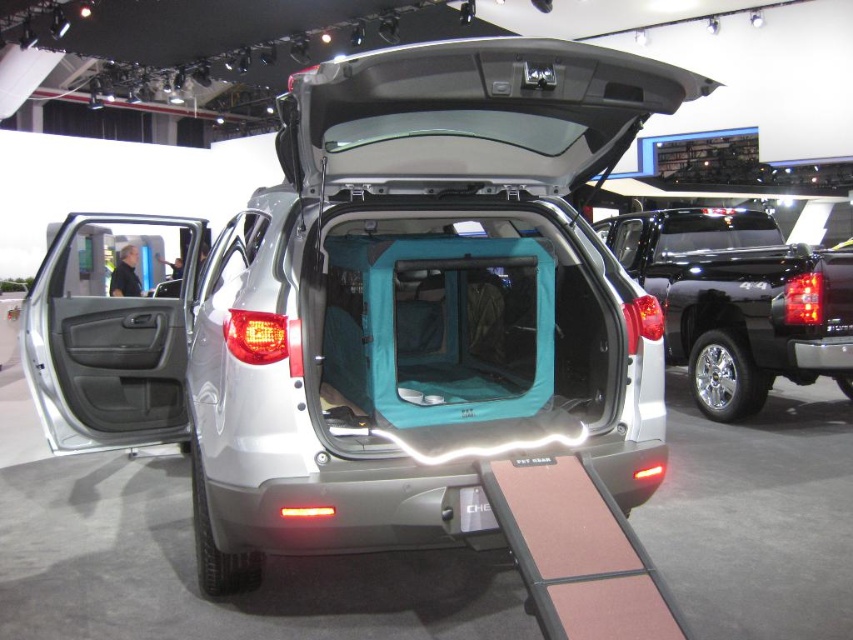
You are a delivery person trying to load a package into the cargo area of the silver Chevrolet vehicle. The package must be placed at point (746, 340). You can only move forward or backward along the ramp. Which direction should you move relative to point (225, 381) to reach the target point?

Since point (225, 381) is in front of point (746, 340), you should move backward along the ramp to reach point (746, 340) from point (225, 381).

You are a parking attendant at an auto show. You need to park the satin silver car at center and the satin black truck at center in a parking space that is 2.5 meters wide. Can both vehicles fit side by side in the space?

The satin silver car at center is wider than the satin black truck at center. However, without knowing the exact widths of both vehicles, it is impossible to determine if they can fit side by side in a 2.5 meter wide parking space.

You are at an auto show and want to take a photo of both the satin silver car at center and the satin black truck at center. Since you can only stand in one spot, which vehicle should you position yourself closer to if you want both to be fully visible in the frame?

You should position yourself closer to the satin black truck at center because the satin silver car at center is to the left of it, allowing both vehicles to be captured in the frame when centered on the truck.